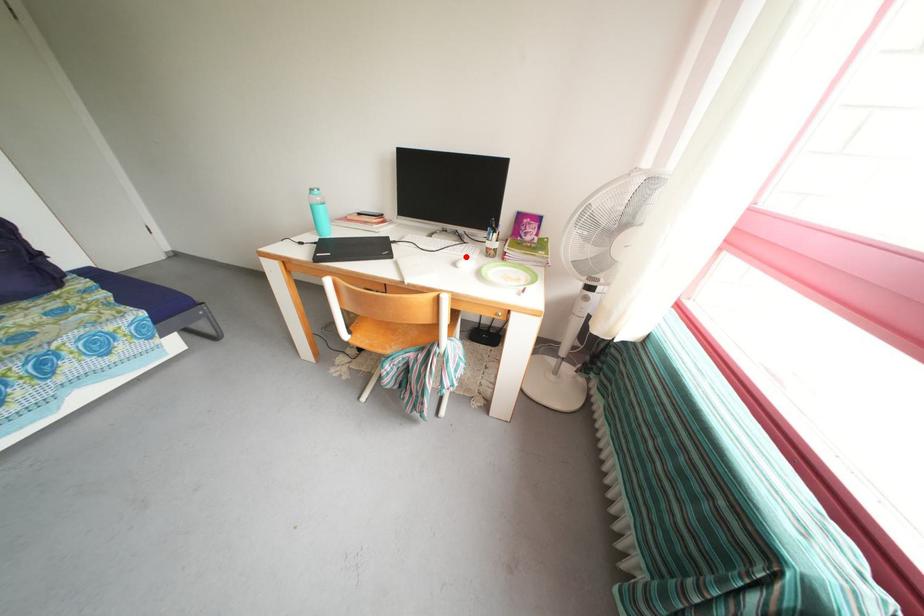
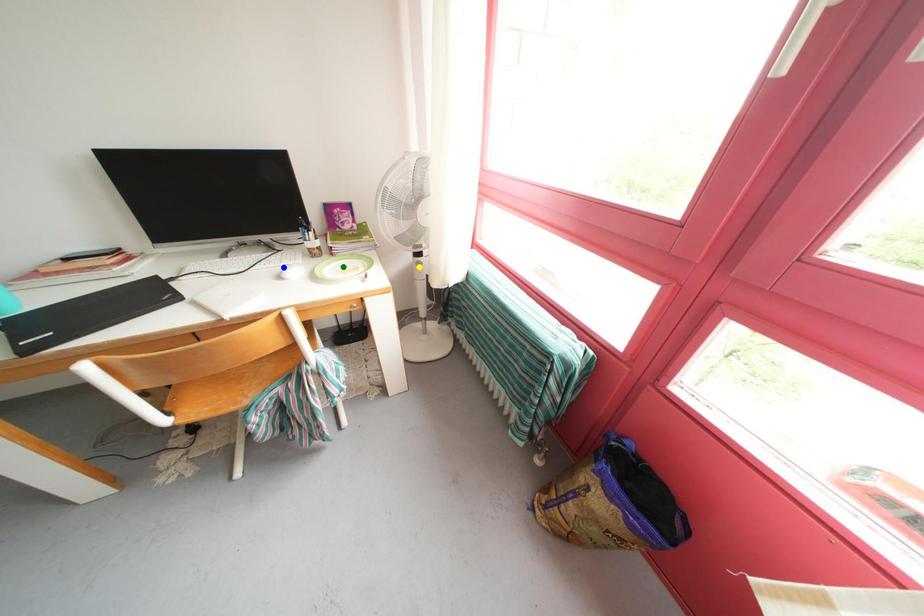
Question: I am providing you with two images of the same scene from different viewpoints. A red point is marked on the first image. You are given multiple points on the second image. Can you choose the point in image 2 that corresponds to the point in image 1?

Choices:
 (A) green point
 (B) yellow point
 (C) blue point

Answer: (C)